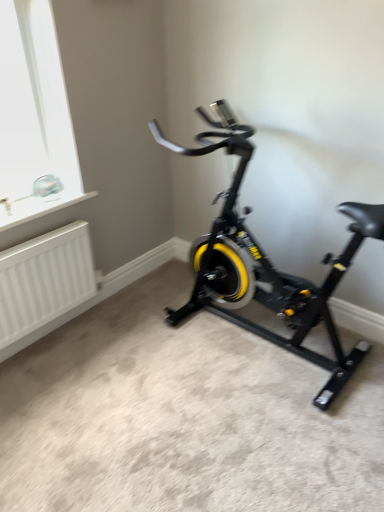
Image resolution: width=384 pixels, height=512 pixels. I want to click on white matte radiator at lower left, so click(44, 280).

What do you see at coordinates (44, 280) in the screenshot? The height and width of the screenshot is (512, 384). I see `white matte radiator at lower left` at bounding box center [44, 280].

What do you see at coordinates (266, 261) in the screenshot? The image size is (384, 512). I see `black matte stationary bicycle at center` at bounding box center [266, 261].

The width and height of the screenshot is (384, 512). What are the coordinates of `black matte stationary bicycle at center` in the screenshot? It's located at (266, 261).

Where is `white matte radiator at lower left`? The image size is (384, 512). white matte radiator at lower left is located at coordinates 44,280.

Considering the relative positions of white matte radiator at lower left and black matte stationary bicycle at center in the image provided, is white matte radiator at lower left to the left or to the right of black matte stationary bicycle at center?

In the image, white matte radiator at lower left appears on the left side of black matte stationary bicycle at center.

Is the position of white matte radiator at lower left less distant than that of black matte stationary bicycle at center?

No, white matte radiator at lower left is behind black matte stationary bicycle at center.

Considering the positions of point (53, 238) and point (326, 389), is point (53, 238) closer or farther from the camera than point (326, 389)?

Clearly, point (53, 238) is more distant from the camera than point (326, 389).

From the image's perspective, who appears lower, white matte radiator at lower left or black matte stationary bicycle at center?

From the image's view, white matte radiator at lower left is below.

From a real-world perspective, is white matte radiator at lower left positioned under black matte stationary bicycle at center based on gravity?

Correct, in the physical world, white matte radiator at lower left is lower than black matte stationary bicycle at center.

Considering the sizes of objects white matte radiator at lower left and black matte stationary bicycle at center in the image provided, who is thinner, white matte radiator at lower left or black matte stationary bicycle at center?

With smaller width is white matte radiator at lower left.

Who is taller, white matte radiator at lower left or black matte stationary bicycle at center?

black matte stationary bicycle at center is taller.

Which of these two, white matte radiator at lower left or black matte stationary bicycle at center, is smaller?

white matte radiator at lower left is smaller.

Is black matte stationary bicycle at center inside white matte radiator at lower left?

No, black matte stationary bicycle at center is not a part of white matte radiator at lower left.

Is white matte radiator at lower left not near black matte stationary bicycle at center?

No, there isn't a large distance between white matte radiator at lower left and black matte stationary bicycle at center.

Could you tell me if white matte radiator at lower left is facing black matte stationary bicycle at center?

Yes, white matte radiator at lower left is turned towards black matte stationary bicycle at center.

How many degrees apart are the facing directions of white matte radiator at lower left and black matte stationary bicycle at center?

90.7 degrees separate the facing orientations of white matte radiator at lower left and black matte stationary bicycle at center.

Identify the location of radiator on the left of black matte stationary bicycle at center. (44, 280).

Consider the image. Can you confirm if black matte stationary bicycle at center is positioned to the right of white matte radiator at lower left?

Yes.

Looking at this image, between black matte stationary bicycle at center and white matte radiator at lower left, which one is positioned behind?

white matte radiator at lower left is more distant.

Which is closer, (257, 261) or (52, 310)?

The point (257, 261) is more forward.

From the image's perspective, is black matte stationary bicycle at center below white matte radiator at lower left?

No.

From a real-world perspective, relative to white matte radiator at lower left, is black matte stationary bicycle at center vertically above or below?

black matte stationary bicycle at center is situated higher than white matte radiator at lower left in the real world.

Is black matte stationary bicycle at center thinner than white matte radiator at lower left?

No.

Considering the sizes of objects black matte stationary bicycle at center and white matte radiator at lower left in the image provided, who is taller, black matte stationary bicycle at center or white matte radiator at lower left?

With more height is black matte stationary bicycle at center.

Looking at the image, does black matte stationary bicycle at center seem bigger or smaller compared to white matte radiator at lower left?

Clearly, black matte stationary bicycle at center is larger in size than white matte radiator at lower left.

Is black matte stationary bicycle at center not within white matte radiator at lower left?

Yes, black matte stationary bicycle at center is not within white matte radiator at lower left.

Can you see black matte stationary bicycle at center touching white matte radiator at lower left?

No, black matte stationary bicycle at center is not beside white matte radiator at lower left.

Could you tell me if black matte stationary bicycle at center is facing white matte radiator at lower left?

No, black matte stationary bicycle at center is not aimed at white matte radiator at lower left.

How many degrees apart are the facing directions of black matte stationary bicycle at center and white matte radiator at lower left?

The angle between the facing direction of black matte stationary bicycle at center and the facing direction of white matte radiator at lower left is 90.7 degrees.

How far apart are black matte stationary bicycle at center and white matte radiator at lower left?

A distance of 33.06 inches exists between black matte stationary bicycle at center and white matte radiator at lower left.

This screenshot has width=384, height=512. Find the location of `stationary bicycle above the white matte radiator at lower left (from a real-world perspective)`. stationary bicycle above the white matte radiator at lower left (from a real-world perspective) is located at coordinates (266, 261).

You are a GUI agent. You are given a task and a screenshot of the screen. Output one action in this format:
    pyautogui.click(x=<x>, y=<y>)
    Task: Click on the stationary bicycle in front of the white matte radiator at lower left
    
    Given the screenshot: What is the action you would take?
    pyautogui.click(x=266, y=261)

Where is `stationary bicycle on the right of white matte radiator at lower left`? The image size is (384, 512). stationary bicycle on the right of white matte radiator at lower left is located at coordinates (266, 261).